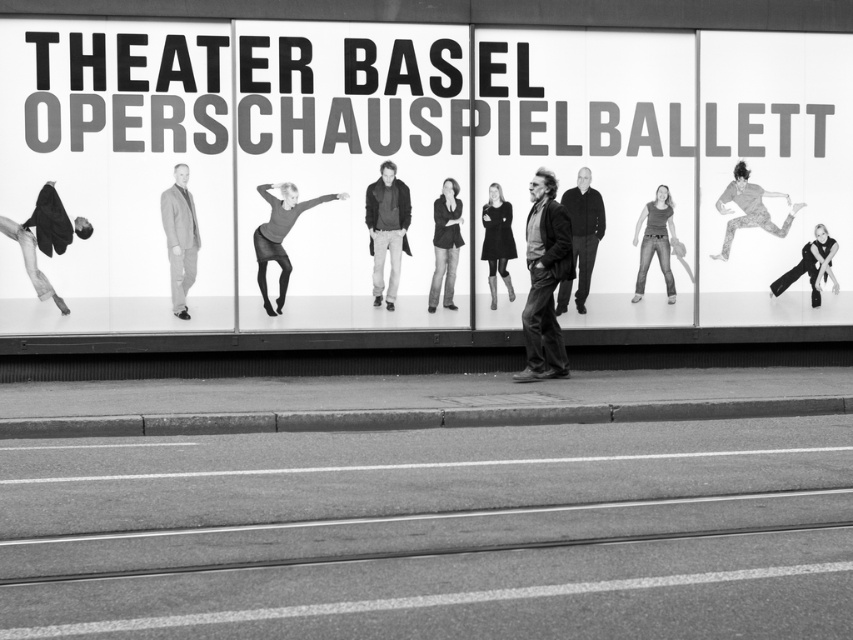
Between dark gray textured coat at center and matte gray tank top at center, which one has more height?

dark gray textured coat at center

Who is more forward, (395, 168) or (663, 248)?

Positioned in front is point (395, 168).

Where is `dark gray textured coat at center`? The image size is (853, 640). dark gray textured coat at center is located at coordinates (387, 228).

Can you confirm if black glossy poster at center is thinner than leather jacket at center?

Incorrect, black glossy poster at center's width is not less than leather jacket at center's.

Which is in front, point (410, 314) or point (561, 241)?

Point (561, 241) is more forward.

The height and width of the screenshot is (640, 853). I want to click on black glossy poster at center, so tap(408, 161).

Is black matte skateboard at left thinner than black matte pants at right?

In fact, black matte skateboard at left might be wider than black matte pants at right.

The height and width of the screenshot is (640, 853). Find the location of `black matte skateboard at left`. black matte skateboard at left is located at coordinates (45, 237).